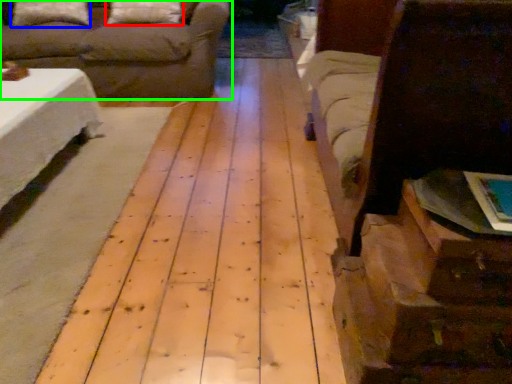
Question: Which object is positioned closest to pillow (highlighted by a red box)? Select from pillow (highlighted by a blue box) and studio couch (highlighted by a green box).

Choices:
 (A) pillow
 (B) studio couch

Answer: (B)